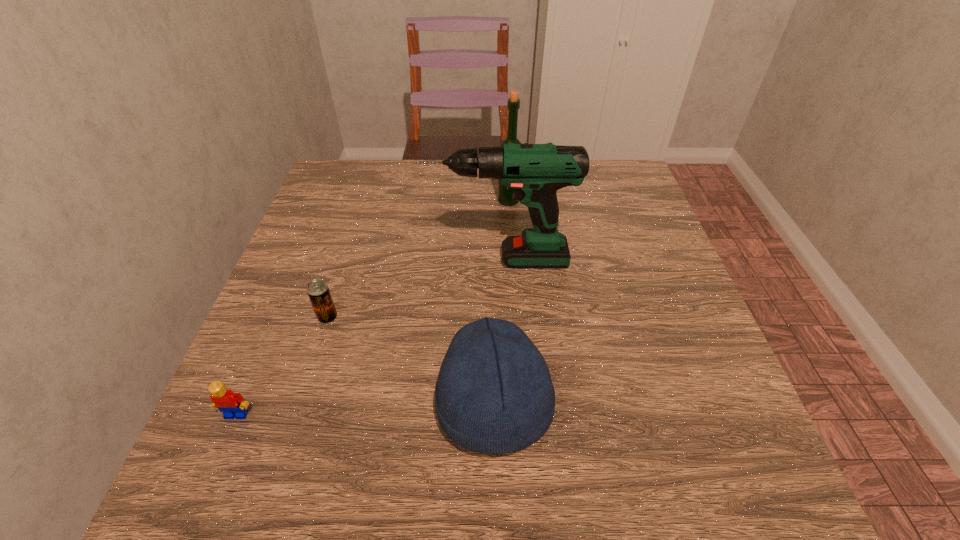
I want to click on free space between the leftmost object and the skullcap, so click(x=366, y=410).

Identify the location of free space between the leftmost object and the third tallest object. This screenshot has height=540, width=960. (366, 410).

Point out which object is positioned as the second nearest to the fourth nearest object. Please provide its 2D coordinates. Your answer should be formatted as a tuple, i.e. [(x, y)], where the tuple contains the x and y coordinates of a point satisfying the conditions above.

[(318, 291)]

Image resolution: width=960 pixels, height=540 pixels. I want to click on the second closest object to the second farthest object, so click(318, 291).

Locate an element on the screen. The image size is (960, 540). vacant region that satisfies the following two spatial constraints: 1. on the handle side of the second farthest object; 2. on the front-facing side of the leftmost object is located at coordinates (503, 415).

Locate an element on the screen. The height and width of the screenshot is (540, 960). free space that satisfies the following two spatial constraints: 1. on the handle side of the drill; 2. on the front side of the third farthest object is located at coordinates (499, 317).